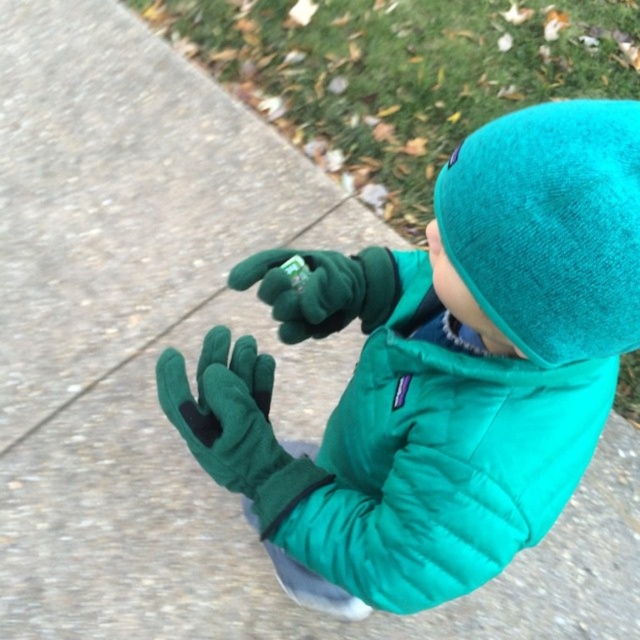
Question: Observing the image, what is the correct spatial positioning of teal fleece hat at upper right in reference to green fleece glove at center?

Choices:
 (A) right
 (B) left

Answer: (A)

Question: Which is farther from the green fleece glove at center?

Choices:
 (A) teal fleece hat at upper right
 (B) green fleece gloves at center
 (C) green fuzzy glove at center

Answer: (A)

Question: Estimate the real-world distances between objects in this image. Which object is closer to the green fuzzy glove at center?

Choices:
 (A) teal fleece hat at upper right
 (B) green fleece glove at center
 (C) green fleece gloves at center

Answer: (B)

Question: Can you confirm if teal fleece hat at upper right is bigger than green fleece glove at center?

Choices:
 (A) yes
 (B) no

Answer: (A)

Question: Which point is farther from the camera taking this photo?

Choices:
 (A) (461, 250)
 (B) (221, 376)

Answer: (B)

Question: Can you confirm if teal fleece hat at upper right is bigger than green fleece glove at center?

Choices:
 (A) no
 (B) yes

Answer: (B)